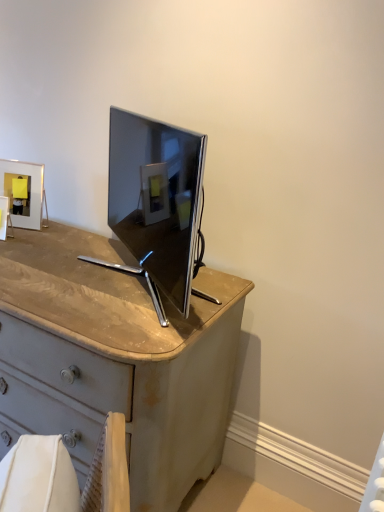
Question: Should I look upward or downward to see matte silver picture frame at upper left, arranged as the 2th picture frame when viewed from the front?

Choices:
 (A) up
 (B) down

Answer: (A)

Question: Can you confirm if matte silver picture frame at upper left, arranged as the 2th picture frame when viewed from the front, is positioned to the right of matte white picture frame at upper left, positioned as the first picture frame in front-to-back order?

Choices:
 (A) no
 (B) yes

Answer: (B)

Question: Can you confirm if matte silver picture frame at upper left, arranged as the 2th picture frame when viewed from the front, is positioned to the left of matte white picture frame at upper left, the 2th picture frame from the back?

Choices:
 (A) yes
 (B) no

Answer: (B)

Question: Considering the relative sizes of matte silver picture frame at upper left, the first picture frame viewed from the back, and matte white picture frame at upper left, the 2th picture frame from the back, in the image provided, is matte silver picture frame at upper left, the first picture frame viewed from the back, taller than matte white picture frame at upper left, the 2th picture frame from the back,?

Choices:
 (A) no
 (B) yes

Answer: (B)

Question: Would you say matte white picture frame at upper left, positioned as the first picture frame in front-to-back order, is part of matte silver picture frame at upper left, the first picture frame viewed from the back,'s contents?

Choices:
 (A) yes
 (B) no

Answer: (B)

Question: From a real-world perspective, is matte silver picture frame at upper left, the first picture frame viewed from the back, on top of matte white picture frame at upper left, the 2th picture frame from the back?

Choices:
 (A) yes
 (B) no

Answer: (A)

Question: Is matte silver picture frame at upper left, the first picture frame viewed from the back, closer to the viewer compared to matte white picture frame at upper left, positioned as the first picture frame in front-to-back order?

Choices:
 (A) no
 (B) yes

Answer: (A)

Question: Is matte white picture frame at upper left, positioned as the first picture frame in front-to-back order, not within matte silver picture frame at upper left, arranged as the 2th picture frame when viewed from the front?

Choices:
 (A) yes
 (B) no

Answer: (A)

Question: From a real-world perspective, is matte white picture frame at upper left, positioned as the first picture frame in front-to-back order, on matte silver picture frame at upper left, arranged as the 2th picture frame when viewed from the front?

Choices:
 (A) yes
 (B) no

Answer: (B)

Question: Is there a large distance between matte white picture frame at upper left, the 2th picture frame from the back, and matte silver picture frame at upper left, arranged as the 2th picture frame when viewed from the front?

Choices:
 (A) yes
 (B) no

Answer: (B)

Question: Does matte white picture frame at upper left, positioned as the first picture frame in front-to-back order, have a greater height compared to matte silver picture frame at upper left, arranged as the 2th picture frame when viewed from the front?

Choices:
 (A) yes
 (B) no

Answer: (B)

Question: Considering the relative sizes of matte white picture frame at upper left, the 2th picture frame from the back, and matte silver picture frame at upper left, arranged as the 2th picture frame when viewed from the front, in the image provided, is matte white picture frame at upper left, the 2th picture frame from the back, thinner than matte silver picture frame at upper left, arranged as the 2th picture frame when viewed from the front,?

Choices:
 (A) no
 (B) yes

Answer: (B)

Question: Is matte white picture frame at upper left, positioned as the first picture frame in front-to-back order, in front of matte silver picture frame at upper left, arranged as the 2th picture frame when viewed from the front?

Choices:
 (A) yes
 (B) no

Answer: (A)

Question: In terms of height, does matte silver picture frame at upper left, arranged as the 2th picture frame when viewed from the front, look taller or shorter compared to matte white picture frame at upper left, the 2th picture frame from the back?

Choices:
 (A) short
 (B) tall

Answer: (B)